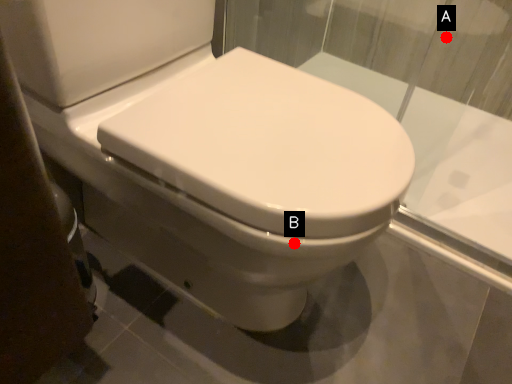
Question: Two points are circled on the image, labeled by A and B beside each circle. Which point appears closest to the camera in this image?

Choices:
 (A) A is closer
 (B) B is closer

Answer: (B)